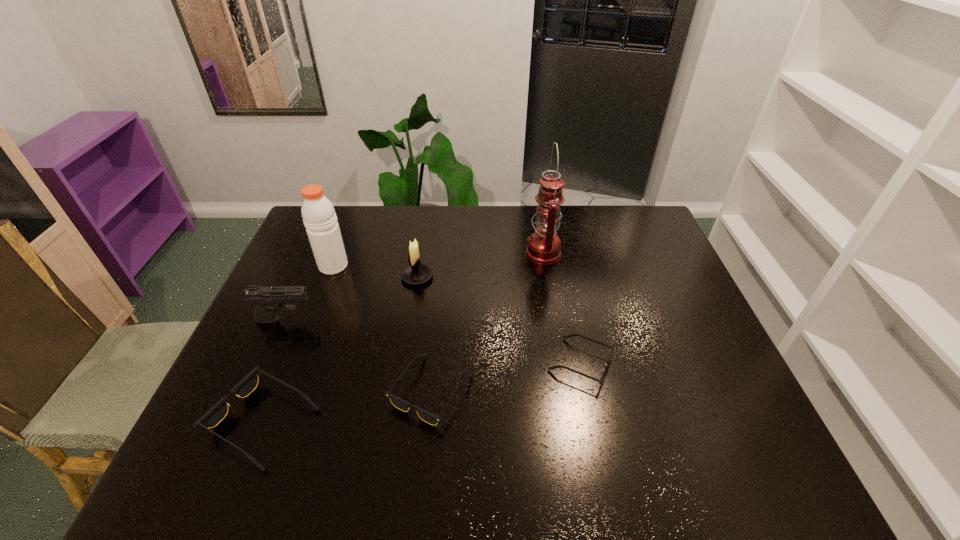
You are a GUI agent. You are given a task and a screenshot of the screen. Output one action in this format:
    pyautogui.click(x=<x>, y=<y>)
    Task: Click on the leftmost sunglasses
    Image resolution: width=960 pixels, height=540 pixels.
    Given the screenshot: What is the action you would take?
    pyautogui.click(x=217, y=413)

Find the location of a particular element. The height and width of the screenshot is (540, 960). the second shortest object is located at coordinates (399, 403).

Image resolution: width=960 pixels, height=540 pixels. What are the coordinates of `the second tallest sunglasses` in the screenshot? It's located at (399, 403).

Identify the location of the shortest object. This screenshot has width=960, height=540. (571, 335).

Identify the location of the shortest sunglasses. (571, 335).

The width and height of the screenshot is (960, 540). I want to click on oil lamp, so click(x=544, y=245).

This screenshot has width=960, height=540. Identify the location of shaker. (319, 217).

This screenshot has width=960, height=540. What are the coordinates of `candle holder` in the screenshot? It's located at (415, 273).

Locate an element on the screen. The width and height of the screenshot is (960, 540). pistol is located at coordinates point(267,300).

At what (x,y) coordinates should I click in order to perform the action: click on the fourth nearest object. Please return your answer as a coordinate pair (x, y). Looking at the image, I should click on (267, 300).